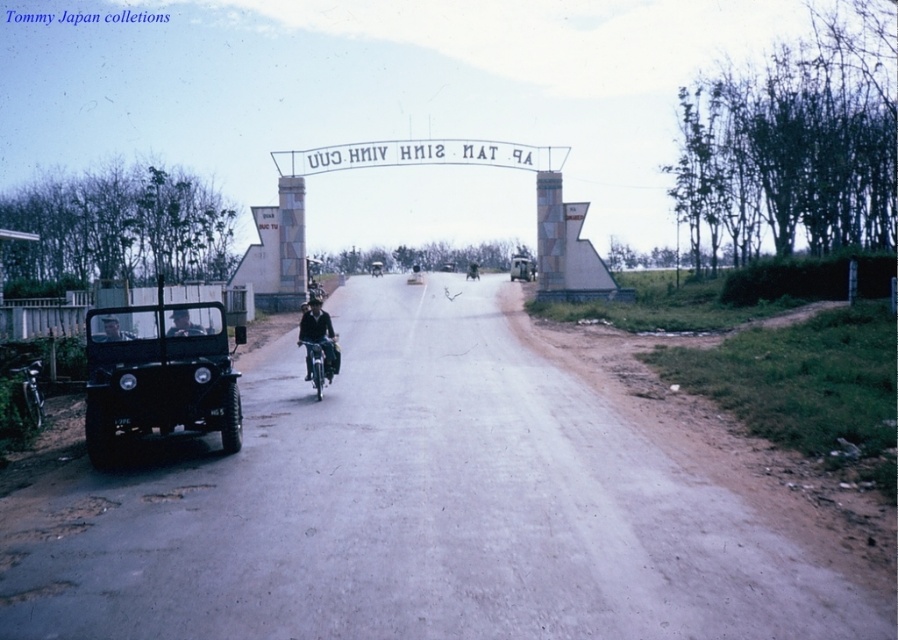
You are standing at the edge of the road near the black military vehicle. You want to throw a small object to a specific point marked as point (x=332, y=168). Considering the distance, can you reach that point with your throw?

The point (x=332, y=168) is 38.07 meters away from the viewer. Since the average throwing distance for a small object is around 20 meters, you cannot reach that point with your throw.

You are a pedestrian standing at the edge of the road near the black military vehicle. You want to cross the road to reach a destination behind the motorcyclist. Which point, point (x=321, y=330) or point (x=514, y=262), should you aim for to ensure you cross in front of the motorcyclist?

You should aim for point (x=321, y=330) because it is closer to the viewer than point (x=514, y=262), meaning the motorcyclist has not yet passed that point and you can safely cross in front of them.